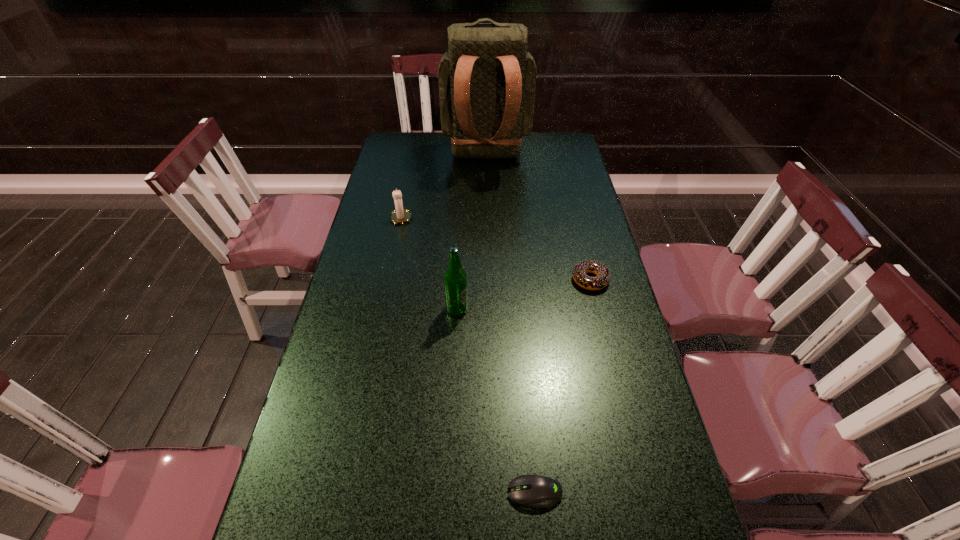
Image resolution: width=960 pixels, height=540 pixels. What are the coordinates of `vacant space located 0.310m on the back of the backpack` in the screenshot? It's located at (488, 235).

I want to click on free region located on the label of the second tallest object, so click(526, 309).

Image resolution: width=960 pixels, height=540 pixels. What are the coordinates of `free space located 0.280m on the handle side of the third tallest object` in the screenshot? It's located at (412, 166).

You are a GUI agent. You are given a task and a screenshot of the screen. Output one action in this format:
    pyautogui.click(x=<x>, y=<y>)
    Task: Click on the vacant point located on the handle side of the third tallest object
    The height and width of the screenshot is (540, 960).
    Given the screenshot: What is the action you would take?
    pyautogui.click(x=412, y=166)

You are a GUI agent. You are given a task and a screenshot of the screen. Output one action in this format:
    pyautogui.click(x=<x>, y=<y>)
    Task: Click on the vacant position located on the handle side of the third tallest object
    
    Given the screenshot: What is the action you would take?
    pyautogui.click(x=406, y=191)

Image resolution: width=960 pixels, height=540 pixels. Identify the location of vacant area situated on the front of the doughnut. (597, 306).

Where is `vacant space situated 0.240m on the wheel side of the nearest object`? This screenshot has width=960, height=540. vacant space situated 0.240m on the wheel side of the nearest object is located at coordinates (388, 492).

The image size is (960, 540). Identify the location of vacant space located on the wheel side of the nearest object. (443, 492).

Find the location of a particular element. free space located 0.230m on the wheel side of the nearest object is located at coordinates (393, 492).

The width and height of the screenshot is (960, 540). What are the coordinates of `object located at the far edge` in the screenshot? It's located at (487, 79).